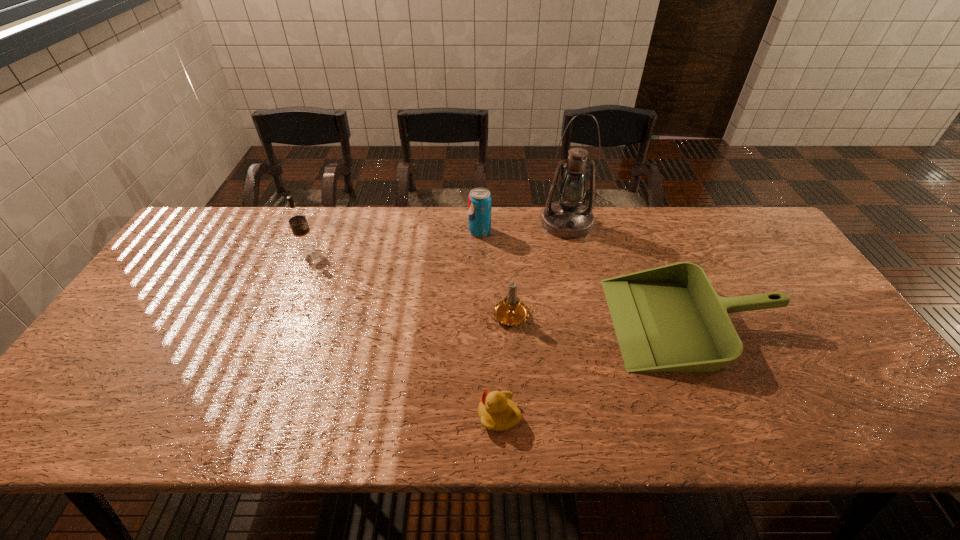
Where is `oil lamp`? oil lamp is located at coordinates (568, 218).

Where is `the third farthest object`? This screenshot has width=960, height=540. the third farthest object is located at coordinates (296, 217).

I want to click on the leftmost object, so click(x=296, y=217).

You are a GUI agent. You are given a task and a screenshot of the screen. Output one action in this format:
    pyautogui.click(x=<x>, y=<y>)
    Task: Click on the soda can
    
    Given the screenshot: What is the action you would take?
    pyautogui.click(x=479, y=200)

You are a GUI agent. You are given a task and a screenshot of the screen. Output one action in this format:
    pyautogui.click(x=<x>, y=<y>)
    Task: Click on the fourth tallest object
    Image resolution: width=960 pixels, height=540 pixels.
    Given the screenshot: What is the action you would take?
    pyautogui.click(x=511, y=311)

Where is `dustpan`? dustpan is located at coordinates (667, 319).

This screenshot has width=960, height=540. I want to click on the shortest object, so coord(497,411).

Locate an element on the screen. This screenshot has height=540, width=960. duckling is located at coordinates (497, 411).

Where is `free spot located 0.350m on the front of the tallest object`? free spot located 0.350m on the front of the tallest object is located at coordinates (590, 324).

Locate an element on the screen. This screenshot has height=540, width=960. blank area located 0.080m on the label of the fifth shortest object is located at coordinates (343, 248).